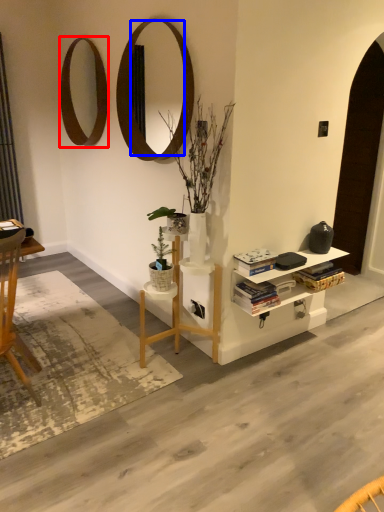
Question: Which object appears closest to the camera in this image, mirror (highlighted by a red box) or mirror (highlighted by a blue box)?

Choices:
 (A) mirror
 (B) mirror

Answer: (B)